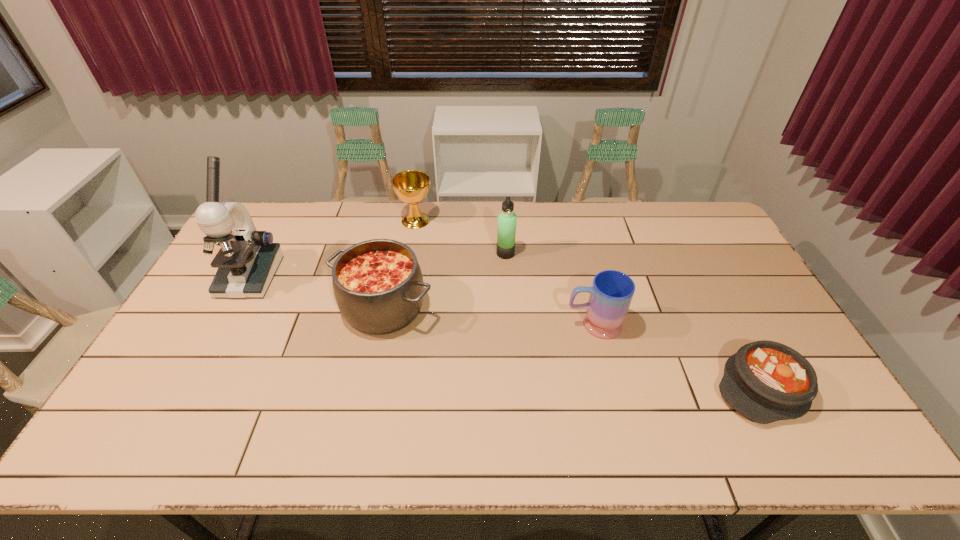
You are a GUI agent. You are given a task and a screenshot of the screen. Output one action in this format:
    pyautogui.click(x=<x>, y=<y>)
    Task: Click on the vacant space that's between the fifth shortest object and the second object from right to left
    This screenshot has height=540, width=960.
    Given the screenshot: What is the action you would take?
    pyautogui.click(x=549, y=289)

I want to click on free space between the mug and the chalice, so click(x=504, y=273).

The image size is (960, 540). I want to click on vacant area that lies between the mug and the chalice, so click(x=504, y=273).

Locate an element on the screen. empty space between the right casserole and the leftmost object is located at coordinates (507, 332).

Locate an element on the screen. free space between the chalice and the thermos bottle is located at coordinates (461, 237).

This screenshot has height=540, width=960. What are the coordinates of `empty location between the fifth object from left to right and the nearest object` in the screenshot? It's located at (679, 356).

At what (x,y) coordinates should I click in order to perform the action: click on the fourth closest object to the tallest object. Please return your answer as a coordinate pair (x, y). Looking at the image, I should click on (611, 293).

At what (x,y) coordinates should I click in order to perform the action: click on object that is the third nearest to the microscope. Please return your answer as a coordinate pair (x, y). This screenshot has width=960, height=540. Looking at the image, I should click on (506, 231).

Image resolution: width=960 pixels, height=540 pixels. Identify the location of free space in the image that satisfies the following two spatial constraints: 1. on the back side of the thermos bottle; 2. on the right side of the left casserole. (396, 253).

Where is `vacant space that satisfies the following two spatial constraints: 1. on the front side of the microscope; 2. on the right side of the shorter casserole`? This screenshot has height=540, width=960. vacant space that satisfies the following two spatial constraints: 1. on the front side of the microscope; 2. on the right side of the shorter casserole is located at coordinates (190, 387).